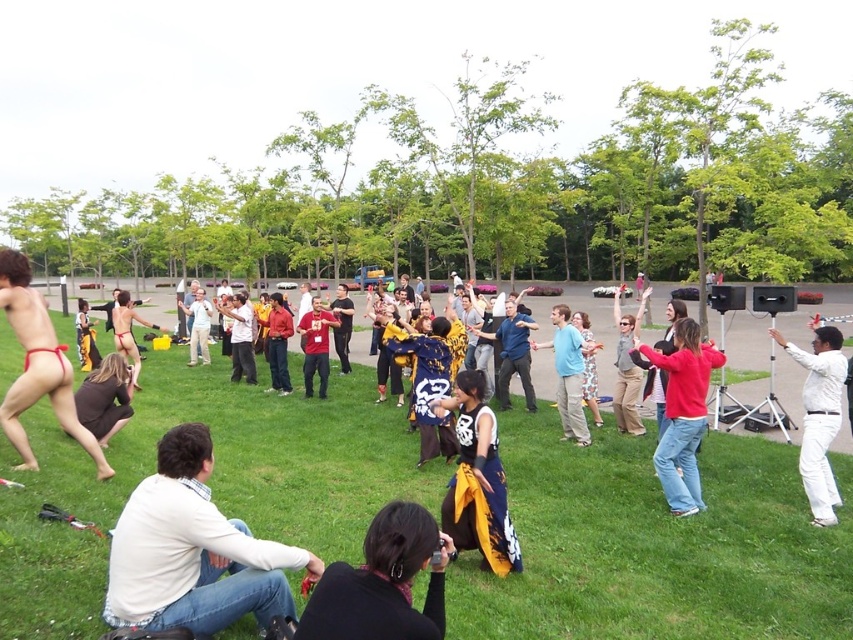
Question: Among these points, which one is nearest to the camera?

Choices:
 (A) (54, 397)
 (B) (144, 432)

Answer: (A)

Question: In this image, where is red matte shirt at center located relative to matte red shirt at center?

Choices:
 (A) above
 (B) below

Answer: (B)

Question: Is matte red thong at left smaller than blue denim jeans at center?

Choices:
 (A) yes
 (B) no

Answer: (A)

Question: Is black fabric at lower center positioned before matte red thong at left?

Choices:
 (A) yes
 (B) no

Answer: (A)

Question: Which of these objects is positioned farthest from the dark blue shirt at center?

Choices:
 (A) black jersey at center
 (B) matte red bikini at center
 (C) black fabric at lower center

Answer: (C)

Question: Which point is closer to the camera?

Choices:
 (A) dark blue shirt at center
 (B) black jersey at center

Answer: (B)